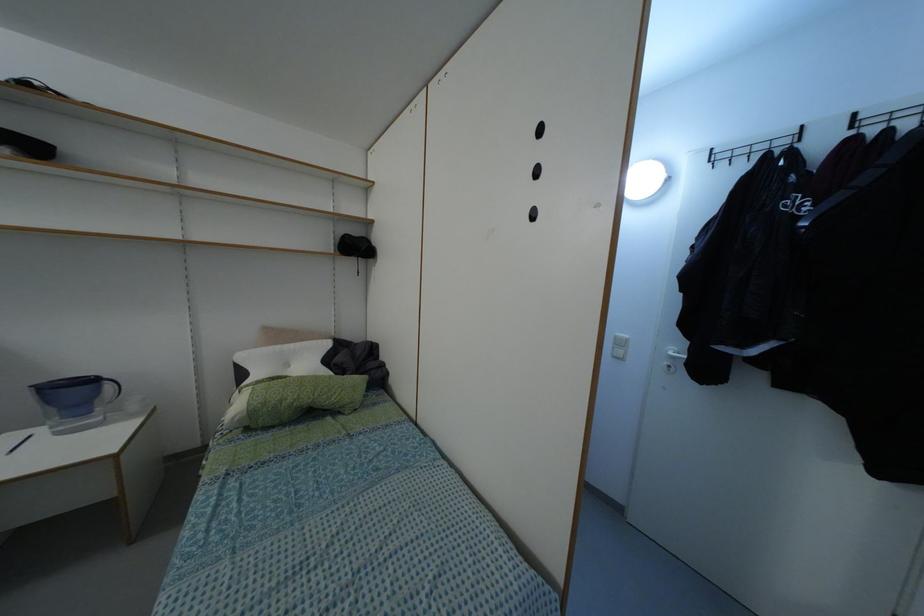
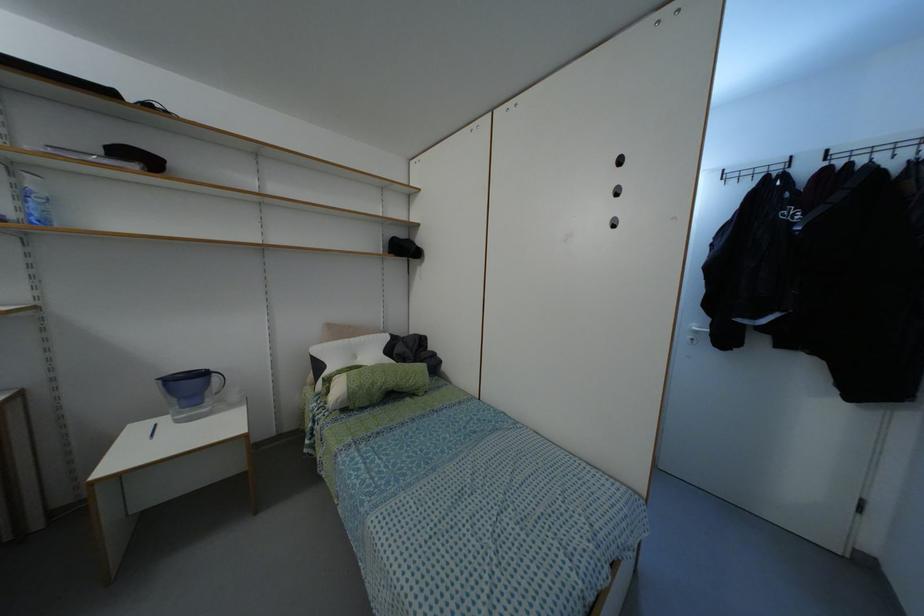
Find the pixel in the second image that matches the point at 107,386 in the first image.

(214, 378)